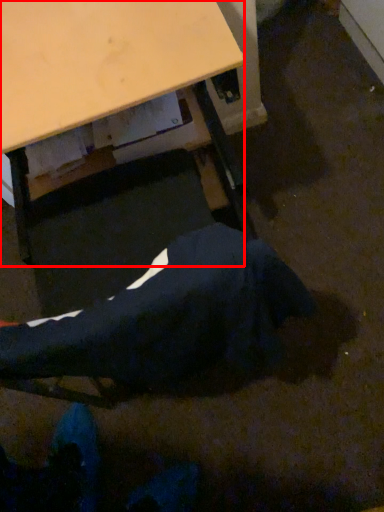
Question: From the image's perspective, what is the correct spatial positioning of desk (annotated by the red box) in reference to robe?

Choices:
 (A) below
 (B) above

Answer: (B)